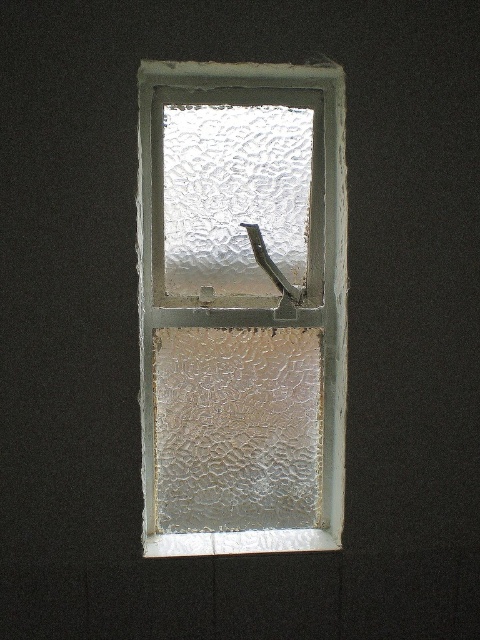
You are standing in front of the window described in the scene. There is a point marked at coordinates point (241,307). Based on the scene description, can you determine what this point is located on?

The point (241,307) is located on the white textured frame at center.

You are an interior designer assessing a room with a window. You notice the white textured frame at center and the frosted glass at center. From the perspective of someone standing directly in front of the window, which object is positioned to the right?

The white textured frame at center is to the right of the frosted glass at center.